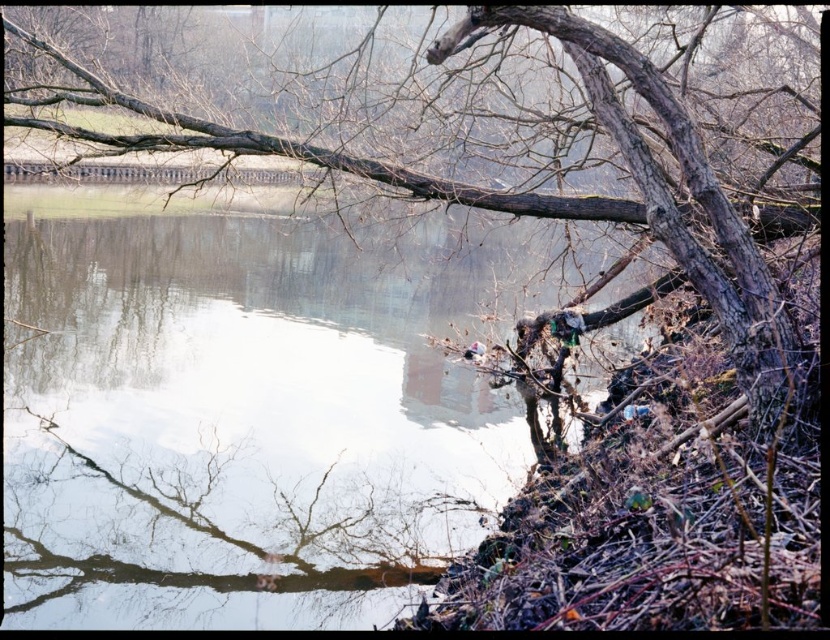
You are standing at the riverside and want to reach a specific point marked at point [57,596]. Given that the distance between you and this point is 6.22 meters, can you safely walk straight to it without encountering any obstacles?

The distance between you and point [57,596] is 6.22 meters. However, the scene description mentions fallen tree trunks and branches creating a natural barrier between the viewer and the river. Therefore, you might encounter obstacles like fallen tree trunks and branches along the way, so it might not be safe to walk straight to the point without checking for obstacles.

You are a kayaker planning to navigate through the clear water at lower left and the brown rough tree at upper right. Which path has a wider passage for your kayak?

The clear water at lower left has a wider passage than the brown rough tree at upper right since its width is larger.

You are a kayaker preparing to paddle through the riverside scene. You need to navigate between the clear water at lower left and the brown rough tree at upper right. Given that your kayak is 12 feet long, will you be able to pass through the space between them without touching either?

The clear water at lower left and brown rough tree at upper right are 11.82 feet apart. Since your kayak is 12 feet long, it will not fit through the space between them as the distance is slightly shorter than the kayak.